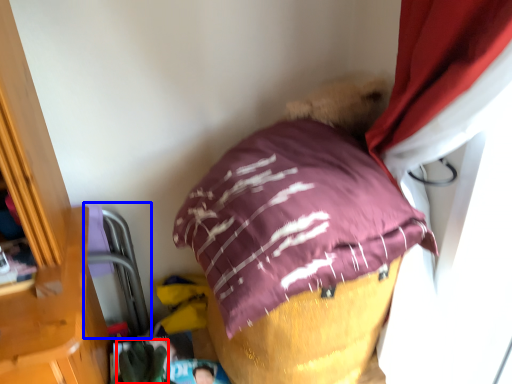
Question: Among these objects, which one is farthest to the camera, clothing (highlighted by a red box) or bean bag chair (highlighted by a blue box)?

Choices:
 (A) clothing
 (B) bean bag chair

Answer: (B)